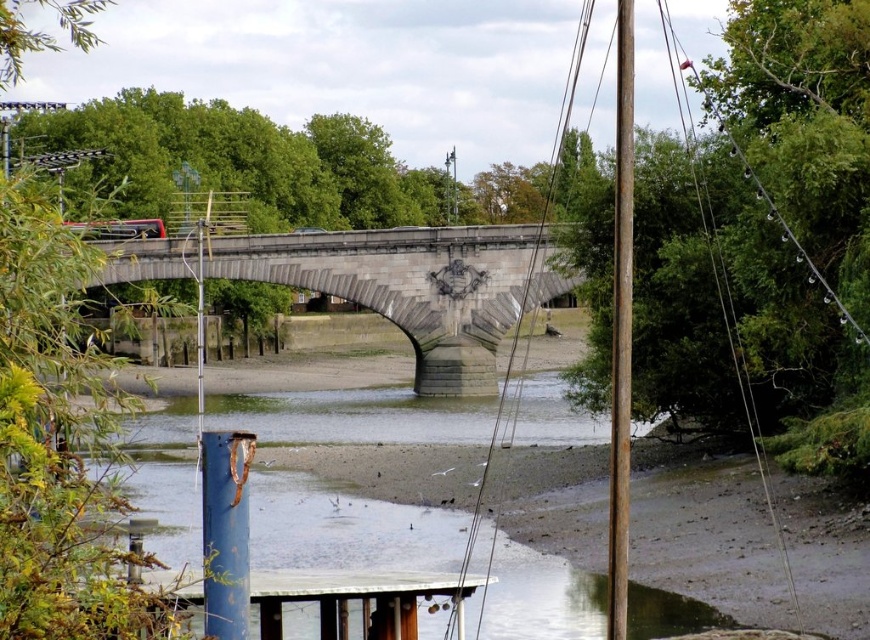
Question: Which object appears closest to the camera in this image?

Choices:
 (A) rusty metal pole at right
 (B) gray stone bridge at center

Answer: (B)

Question: Does wooden dock at lower center come in front of rusty metal pole at right?

Choices:
 (A) yes
 (B) no

Answer: (A)

Question: Is gray stone bridge at center above blue metallic pole at center-left?

Choices:
 (A) yes
 (B) no

Answer: (A)

Question: Considering the real-world distances, which object is farthest from the wooden dock at lower center?

Choices:
 (A) blue metallic pole at center-left
 (B) rusty metal pole at right

Answer: (A)

Question: Which point is closer to the camera?

Choices:
 (A) blue metallic pole at center-left
 (B) gray stone bridge at center
 (C) wooden dock at lower center

Answer: (C)

Question: Can you confirm if gray stone bridge at center is bigger than wooden dock at lower center?

Choices:
 (A) yes
 (B) no

Answer: (A)